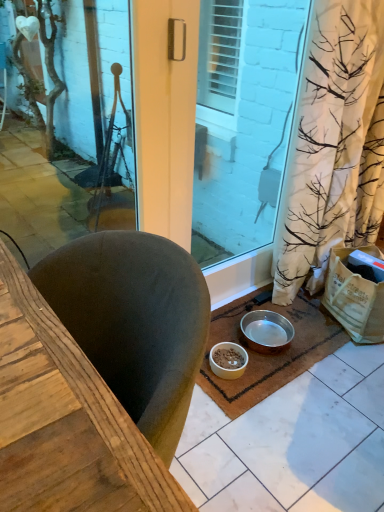
Question: Is brown coir mat at lower center far from white matte bowl at lower center, arranged as the 2th bowl when viewed from the right?

Choices:
 (A) no
 (B) yes

Answer: (A)

Question: Is brown coir mat at lower center in front of white matte bowl at lower center, arranged as the 2th bowl when viewed from the right?

Choices:
 (A) no
 (B) yes

Answer: (B)

Question: Is brown coir mat at lower center beside white matte bowl at lower center, the first bowl when ordered from left to right?

Choices:
 (A) yes
 (B) no

Answer: (B)

Question: Is brown coir mat at lower center outside of white matte bowl at lower center, the first bowl when ordered from left to right?

Choices:
 (A) no
 (B) yes

Answer: (B)

Question: From the image's perspective, is brown coir mat at lower center over white matte bowl at lower center, arranged as the 2th bowl when viewed from the right?

Choices:
 (A) no
 (B) yes

Answer: (B)

Question: Can you confirm if brown coir mat at lower center is positioned to the left of white matte bowl at lower center, arranged as the 2th bowl when viewed from the right?

Choices:
 (A) no
 (B) yes

Answer: (A)

Question: Is white matte bowl at lower center, arranged as the 2th bowl when viewed from the right, looking in the opposite direction of brown coir mat at lower center?

Choices:
 (A) yes
 (B) no

Answer: (B)

Question: Considering the relative sizes of white matte bowl at lower center, the first bowl when ordered from left to right, and brown coir mat at lower center in the image provided, is white matte bowl at lower center, the first bowl when ordered from left to right, thinner than brown coir mat at lower center?

Choices:
 (A) no
 (B) yes

Answer: (B)

Question: Can you confirm if white matte bowl at lower center, arranged as the 2th bowl when viewed from the right, is wider than brown coir mat at lower center?

Choices:
 (A) no
 (B) yes

Answer: (A)

Question: Does white matte bowl at lower center, the first bowl when ordered from left to right, have a smaller size compared to brown coir mat at lower center?

Choices:
 (A) yes
 (B) no

Answer: (A)

Question: Considering the relative positions of white matte bowl at lower center, arranged as the 2th bowl when viewed from the right, and brown coir mat at lower center in the image provided, is white matte bowl at lower center, arranged as the 2th bowl when viewed from the right, behind brown coir mat at lower center?

Choices:
 (A) yes
 (B) no

Answer: (A)

Question: Is white matte bowl at lower center, arranged as the 2th bowl when viewed from the right, surrounding brown coir mat at lower center?

Choices:
 (A) no
 (B) yes

Answer: (A)

Question: Does white matte bowl at lower center, arranged as the 2th bowl when viewed from the right, have a greater width compared to metallic silver bowl at lower center, placed as the first bowl when sorted from right to left?

Choices:
 (A) no
 (B) yes

Answer: (A)